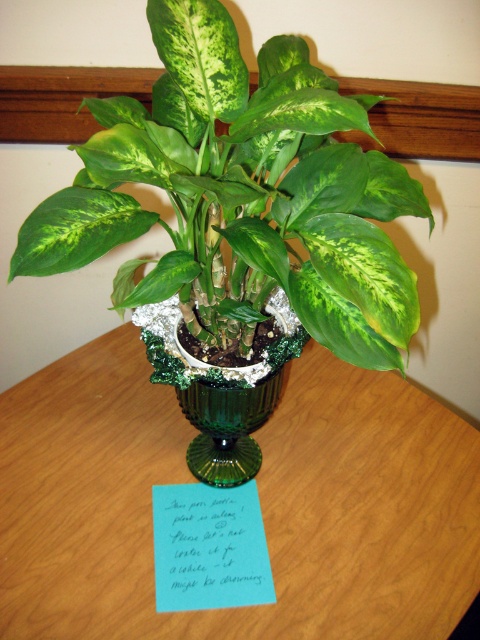
You are a florist arranging a display and need to ensure the green glossy leafy plant at center and the green textured vase at center are visible to customers. Since the plant is blocking the view of the vase, how can you adjust their positions to make both visible?

Since the green glossy leafy plant at center is much taller than the green textured vase at center, you can lower the height of the plant or raise the vase to ensure both are visible.

You are organizing a small desk and need to place both the green glossy leafy plant at center and the blue paper note at center. Based on their sizes, which object should you place first to ensure both fit on the desk?

The green glossy leafy plant at center might be wider than blue paper note at center, so you should place the green glossy leafy plant at center first to ensure there is enough space for both items.

You are standing in front of the potted plant on the wooden surface. There are two points marked in the image. The first point is at coordinates point (191, 276) and the second is at point (189, 544). If you were to walk towards the plant, which point would you encounter first?

Point (191, 276) is in front of point (189, 544), so you would encounter point (191, 276) first as you walk towards the plant.